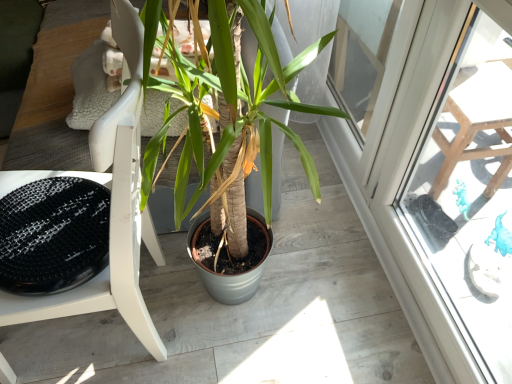
At what (x,y) coordinates should I click in order to perform the action: click on free point below white matte chair at center (from a real-world perspective). Please return your answer as a coordinate pair (x, y). This screenshot has height=384, width=512. Looking at the image, I should click on (112, 331).